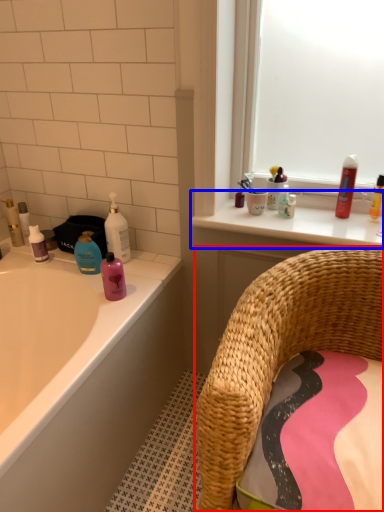
Question: Which of the following is the closest to the observer, chair (highlighted by a red box) or counter top (highlighted by a blue box)?

Choices:
 (A) chair
 (B) counter top

Answer: (A)